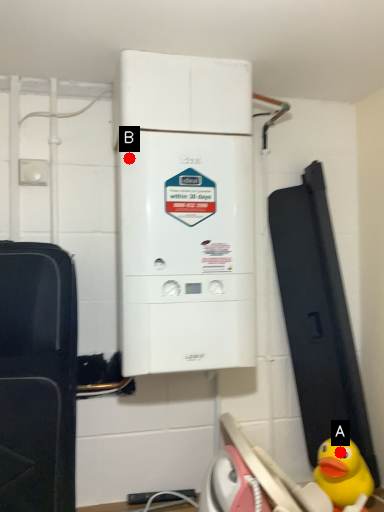
Question: Two points are circled on the image, labeled by A and B beside each circle. Among these points, which one is nearest to the camera?

Choices:
 (A) A is closer
 (B) B is closer

Answer: (B)